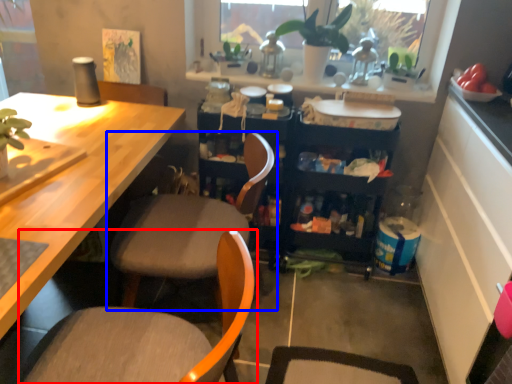
Question: Which point is further to the camera, chair (highlighted by a red box) or chair (highlighted by a blue box)?

Choices:
 (A) chair
 (B) chair

Answer: (B)